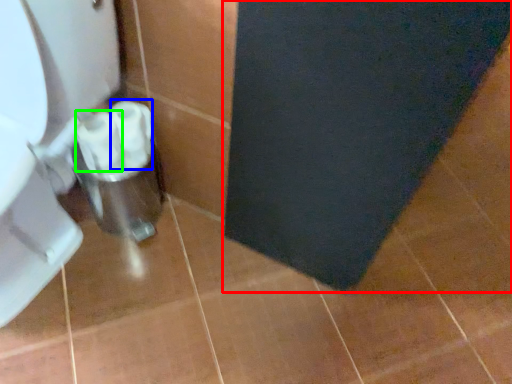
Question: Which is nearer to the bath mat (highlighted by a red box)? toilet paper (highlighted by a blue box) or toilet paper (highlighted by a green box).

Choices:
 (A) toilet paper
 (B) toilet paper

Answer: (A)